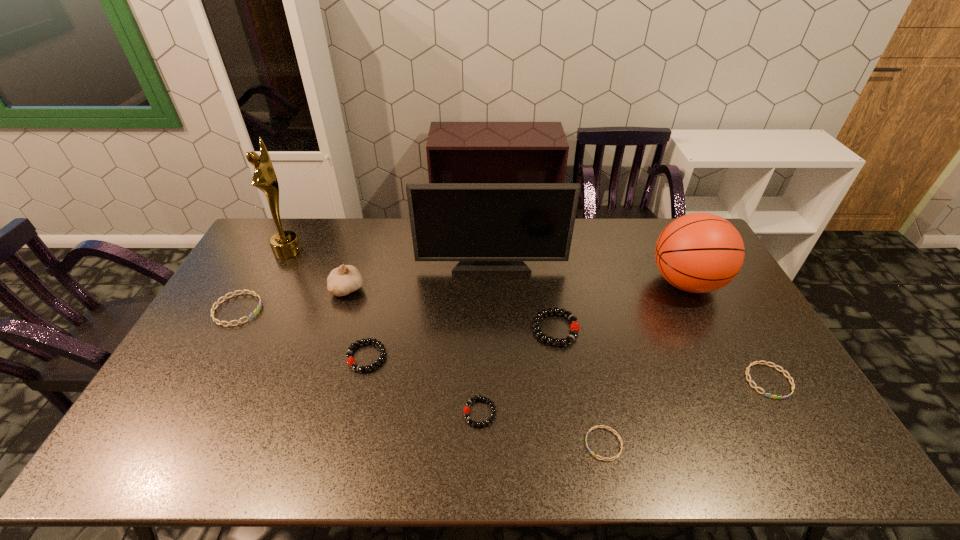
Find the location of a particular element. This screenshot has height=540, width=960. the second closest blue bracelet to the eighth object from right to left is located at coordinates (615, 457).

At what (x,y) coordinates should I click in order to perform the action: click on free location that satisfies the following two spatial constraints: 1. on the surface of the farthest blue bracelet showing star-shaped elements; 2. on the right side of the smallest black bracelet. Please return your answer as a coordinate pair (x, y). This screenshot has width=960, height=540. Looking at the image, I should click on (180, 413).

Identify the location of vacant space that satisfies the following two spatial constraints: 1. on the front side of the garlic; 2. on the left side of the leftmost black bracelet. (326, 357).

At what (x,y) coordinates should I click in order to perform the action: click on free point that satisfies the following two spatial constraints: 1. on the surface of the rightmost blue bracelet showing star-shaped elements; 2. on the surface of the smallest blue bracelet showing star-shaped elements. Please return your answer as a coordinate pair (x, y). This screenshot has height=540, width=960. Looking at the image, I should click on (804, 444).

The height and width of the screenshot is (540, 960). In order to click on vacant space that satisfies the following two spatial constraints: 1. on the back side of the second smallest black bracelet; 2. on the front-facing side of the tallest object in this screenshot , I will do `click(392, 251)`.

Where is `vacant area in the image that satisfies the following two spatial constraints: 1. on the surface of the second smallest black bracelet showing star-shaped elements; 2. on the right side of the leftmost blue bracelet`? This screenshot has width=960, height=540. vacant area in the image that satisfies the following two spatial constraints: 1. on the surface of the second smallest black bracelet showing star-shaped elements; 2. on the right side of the leftmost blue bracelet is located at coordinates (211, 357).

What are the coordinates of `vacant region that satisfies the following two spatial constraints: 1. on the surface of the second nearest blue bracelet showing star-shaped elements; 2. on the surface of the second blue bracelet from right to left showing star-shaped elements` in the screenshot? It's located at (804, 444).

At what (x,y) coordinates should I click in order to perform the action: click on free region that satisfies the following two spatial constraints: 1. on the front-facing side of the tallest object; 2. on the left side of the second bracelet from left to right. Please return your answer as a coordinate pair (x, y). Image resolution: width=960 pixels, height=540 pixels. Looking at the image, I should click on (233, 357).